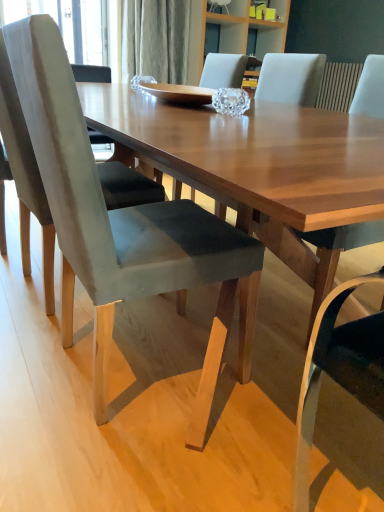
Locate an element on the screen. The height and width of the screenshot is (512, 384). vacant space in velvet gray chair at center, positioned as the 2th chair in left-to-right order (from a real-world perspective) is located at coordinates (145, 388).